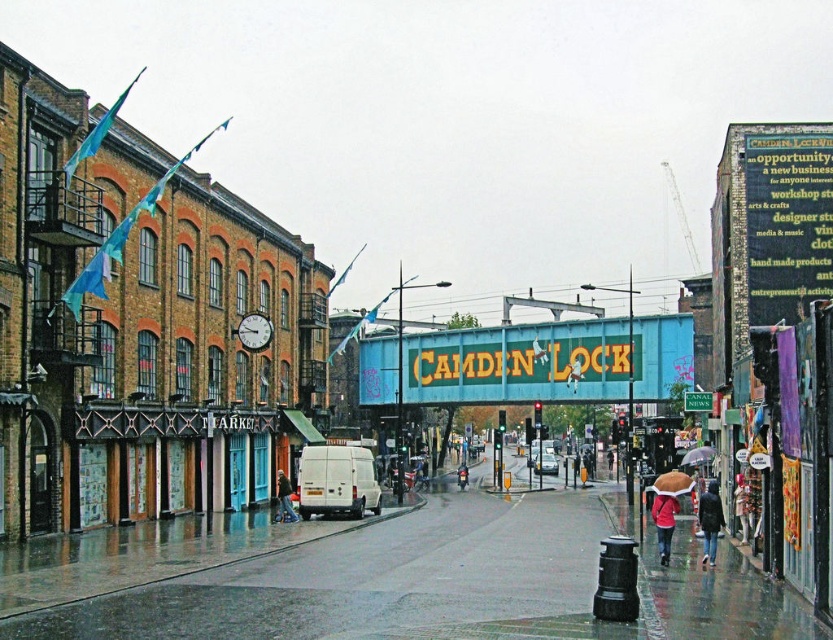
You are standing on the pedestrian bridge in Camden Lock and want to take a photo of both the point at coordinates (446, 356) and the point at (702, 561). Which point should you focus on first to ensure both are in focus?

You should focus on the point at coordinates (446, 356) first because it is closer to the camera than the point at (702, 561). This ensures that both points will be in focus as the closer point determines the focal plane.

You are a delivery person standing on the glossy concrete pavement at lower center and need to place a package on the red matte jacket at lower right. Can you do this without stepping off the pavement?

The glossy concrete pavement at lower center has a greater height compared to the red matte jacket at lower right, so yes, you can place the package on the red matte jacket at lower right without needing to step off the pavement since it is lower.

You are a street vendor who wants to place your new teal painted metal signboard at center and dark gray fabric umbrella at lower right on the wet pavement. Given the space constraints, which object requires more horizontal space?

The teal painted metal signboard at center requires more horizontal space because its width surpasses that of the dark gray fabric umbrella at lower right.